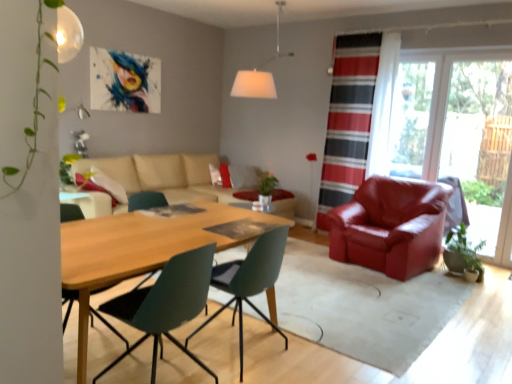
Question: Would you say matte green chair at center, acting as the 2th chair starting from the front, is to the left or to the right of transparent plastic window screen at upper right in the picture?

Choices:
 (A) right
 (B) left

Answer: (B)

Question: From the image's perspective, is matte green chair at center, marked as the 2th chair in a left-to-right arrangement, located above or below transparent plastic window screen at upper right?

Choices:
 (A) above
 (B) below

Answer: (B)

Question: Based on their relative distances, which object is nearer to the beige fabric couch at center?

Choices:
 (A) teal plastic chair at center, which is counted as the 1th chair, starting from the front
 (B) wooden table at center
 (C) striped fabric curtain at right
 (D) matte green chair at center, positioned as the 2th chair in back-to-front order
 (E) satin red armchair at right, the 3th chair positioned from the left

Answer: (C)

Question: Which of these objects is positioned farthest from the white fabric lampshade at upper center?

Choices:
 (A) green matte houseplant at lower right
 (B) matte green chair at center, positioned as the 2th chair in back-to-front order
 (C) satin red armchair at right, placed as the first chair when sorted from right to left
 (D) teal plastic chair at center, which is counted as the 1th chair, starting from the front
 (E) striped fabric curtain at right

Answer: (D)